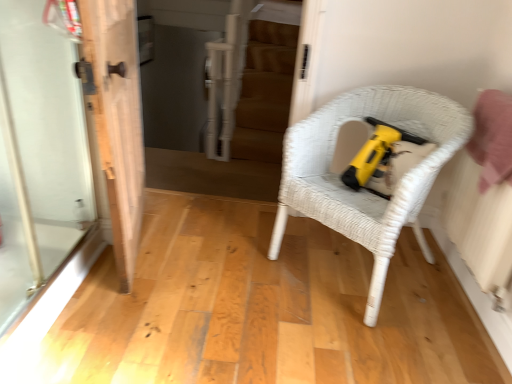
Question: Considering the relative sizes of white wood door at left and white wicker chair at center in the image provided, is white wood door at left taller than white wicker chair at center?

Choices:
 (A) no
 (B) yes

Answer: (B)

Question: Is white wood door at left not near white wicker chair at center?

Choices:
 (A) yes
 (B) no

Answer: (B)

Question: Is white wood door at left next to white wicker chair at center and touching it?

Choices:
 (A) no
 (B) yes

Answer: (A)

Question: From a real-world perspective, is white wood door at left physically above white wicker chair at center?

Choices:
 (A) yes
 (B) no

Answer: (A)

Question: Is white wood door at left aimed at white wicker chair at center?

Choices:
 (A) no
 (B) yes

Answer: (B)

Question: In the image, is white wood door at left positioned in front of or behind white wicker chair at center?

Choices:
 (A) behind
 (B) front

Answer: (B)

Question: In terms of width, does white wood door at left look wider or thinner when compared to white wicker chair at center?

Choices:
 (A) thin
 (B) wide

Answer: (A)

Question: Considering the positions of white wood door at left and white wicker chair at center in the image, is white wood door at left taller or shorter than white wicker chair at center?

Choices:
 (A) tall
 (B) short

Answer: (A)

Question: Based on their positions, is white wood door at left located to the left or right of white wicker chair at center?

Choices:
 (A) left
 (B) right

Answer: (A)

Question: Considering the positions of white wicker chair at center and transparent glass screen door at left in the image, is white wicker chair at center wider or thinner than transparent glass screen door at left?

Choices:
 (A) thin
 (B) wide

Answer: (B)

Question: Relative to transparent glass screen door at left, is white wicker chair at center in front or behind?

Choices:
 (A) front
 (B) behind

Answer: (B)

Question: From the image's perspective, relative to transparent glass screen door at left, is white wicker chair at center above or below?

Choices:
 (A) above
 (B) below

Answer: (B)

Question: Visually, is white wicker chair at center positioned to the left or to the right of transparent glass screen door at left?

Choices:
 (A) right
 (B) left

Answer: (A)

Question: From a real-world perspective, is transparent glass screen door at left positioned above or below white wicker chair at center?

Choices:
 (A) above
 (B) below

Answer: (A)

Question: From the image's perspective, is transparent glass screen door at left above or below white wicker chair at center?

Choices:
 (A) above
 (B) below

Answer: (A)